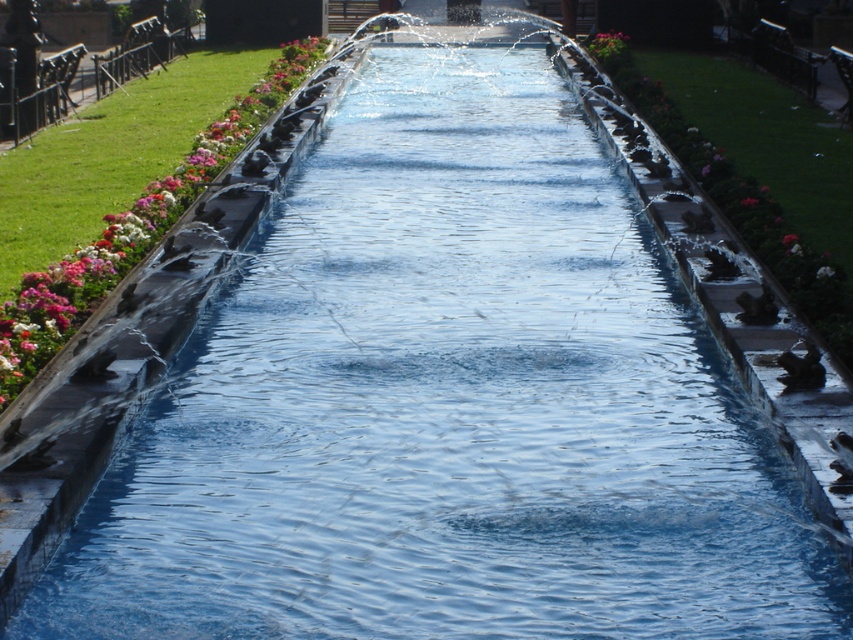
Does pink matte flower at upper center have a greater height compared to pink matte flower at center?

Correct, pink matte flower at upper center is much taller as pink matte flower at center.

Based on the photo, who is taller, pink matte flower at upper center or pink matte flower at center?

With more height is pink matte flower at upper center.

Who is more distant from viewer, (621, 44) or (784, 236)?

Point (621, 44)

Image resolution: width=853 pixels, height=640 pixels. What are the coordinates of `pink matte flower at upper center` in the screenshot? It's located at (607, 44).

Can you confirm if pink glossy flower at left is shorter than pink matte flower at center?

Incorrect, pink glossy flower at left's height does not fall short of pink matte flower at center's.

Does pink glossy flower at left lie in front of pink matte flower at center?

Yes, it is in front of pink matte flower at center.

Is point (251, 122) positioned in front of point (787, 236)?

No.

Identify the location of pink glossy flower at left. (131, 230).

Is pink glossy flower at left to the left of pink matte flower at upper center from the viewer's perspective?

Yes, pink glossy flower at left is to the left of pink matte flower at upper center.

Is pink glossy flower at left below pink matte flower at upper center?

Correct, pink glossy flower at left is located below pink matte flower at upper center.

Which is in front, point (117, 250) or point (601, 51)?

Positioned in front is point (117, 250).

This screenshot has height=640, width=853. Identify the location of pink glossy flower at left. [x=131, y=230].